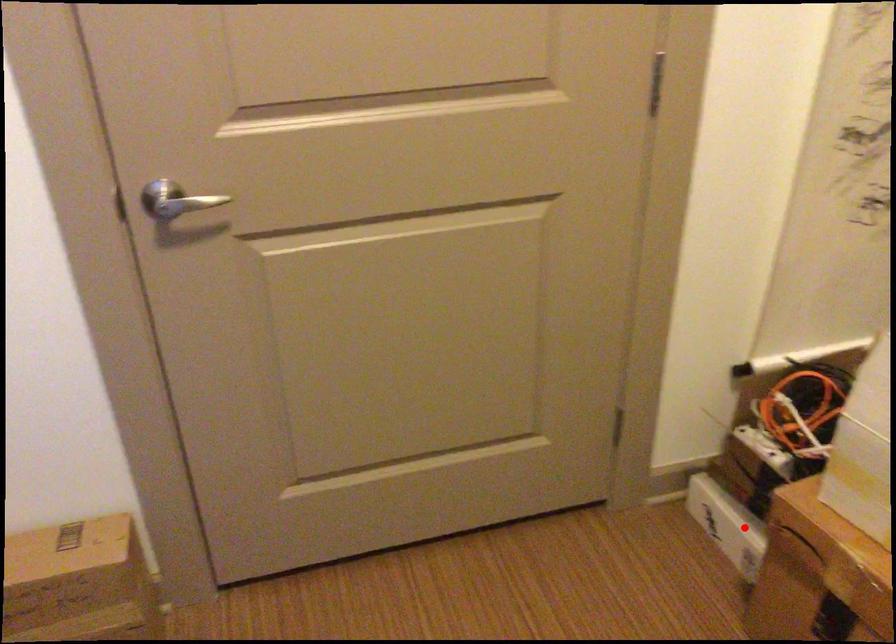
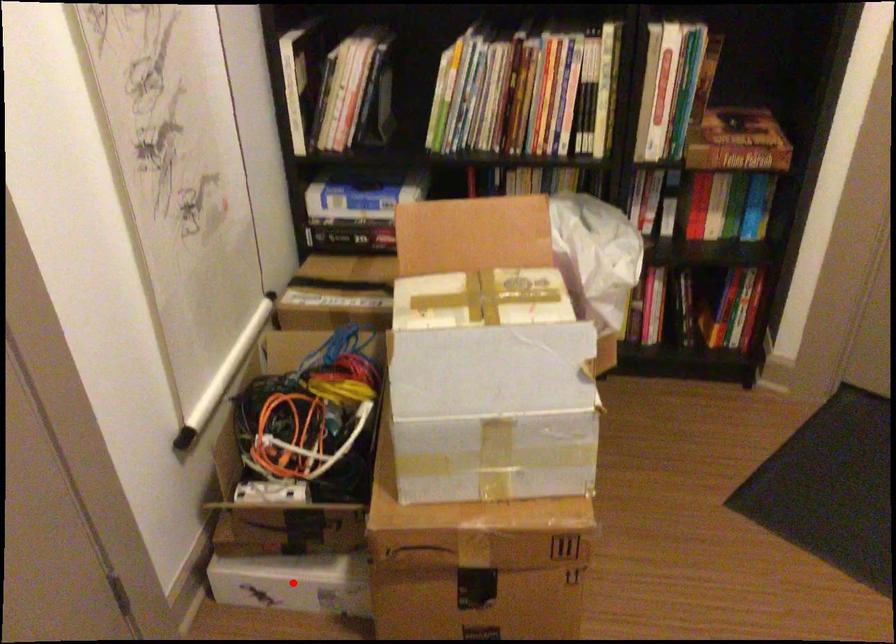
I am providing you with two images of the same scene from different viewpoints. A red point is marked on the first image and another point is marked on the second image. Do the highlighted points in image1 and image2 indicate the same real-world spot?

Yes